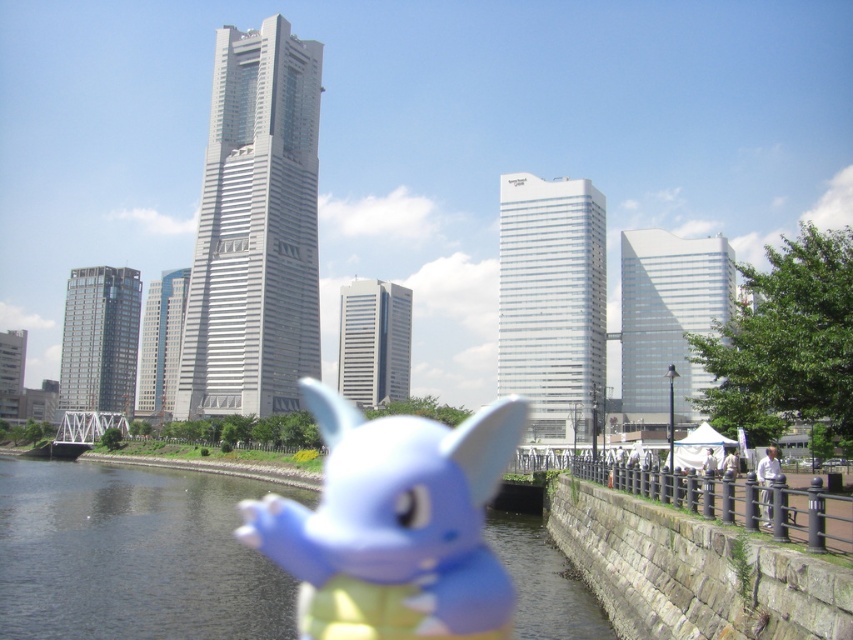
You are a photographer standing in a city park with a camera. You notice a point at coordinates (132, 556) on your camera screen. What does this point represent in the scene?

The point at coordinates (132, 556) marks smooth dark water at center.

You are taking a photo of the city skyline with a camera. There are two objects in your viewfinder, a smooth dark water at center and a matte blue plush toy at center. Which object is closer to the camera?

The matte blue plush toy at center is closer to the camera because the smooth dark water at center is located below it, indicating it is further away.